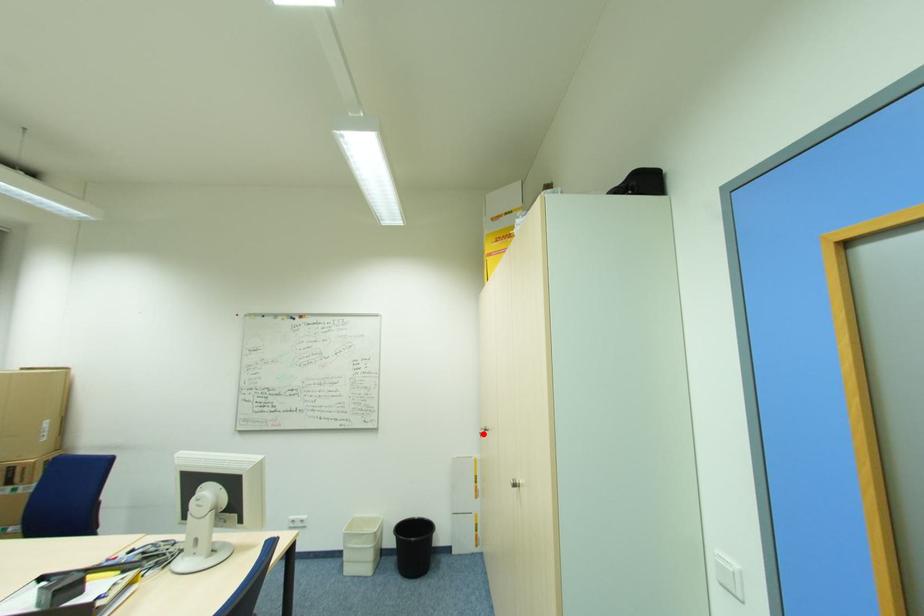
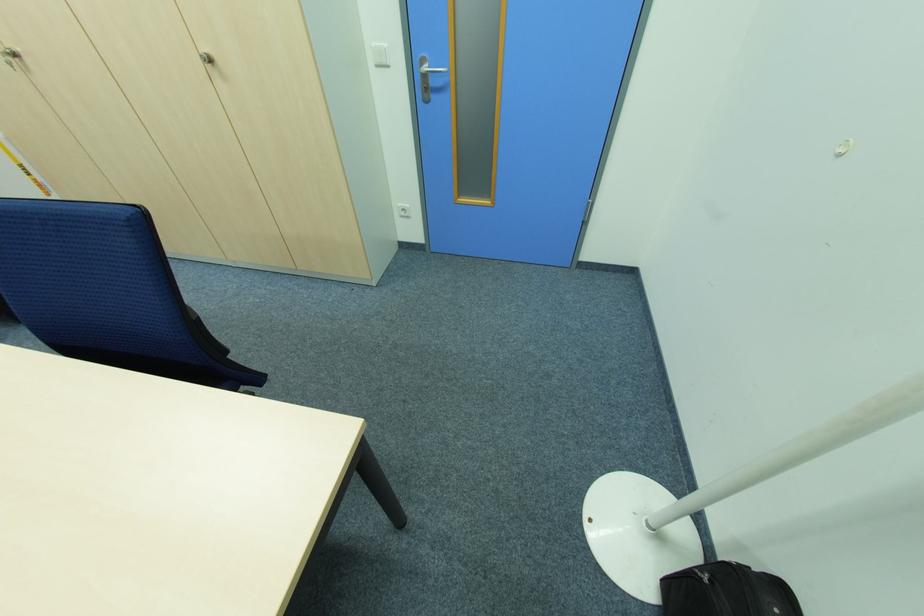
The point at the highlighted location is marked in the first image. Where is the corresponding point in the second image?

(14, 65)